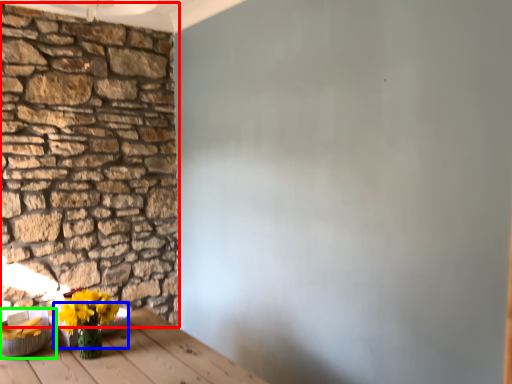
Question: Based on their relative distances, which object is farther from brick (highlighted by a red box)? Choose from bowl (highlighted by a blue box) and bowl (highlighted by a green box).

Choices:
 (A) bowl
 (B) bowl

Answer: (A)